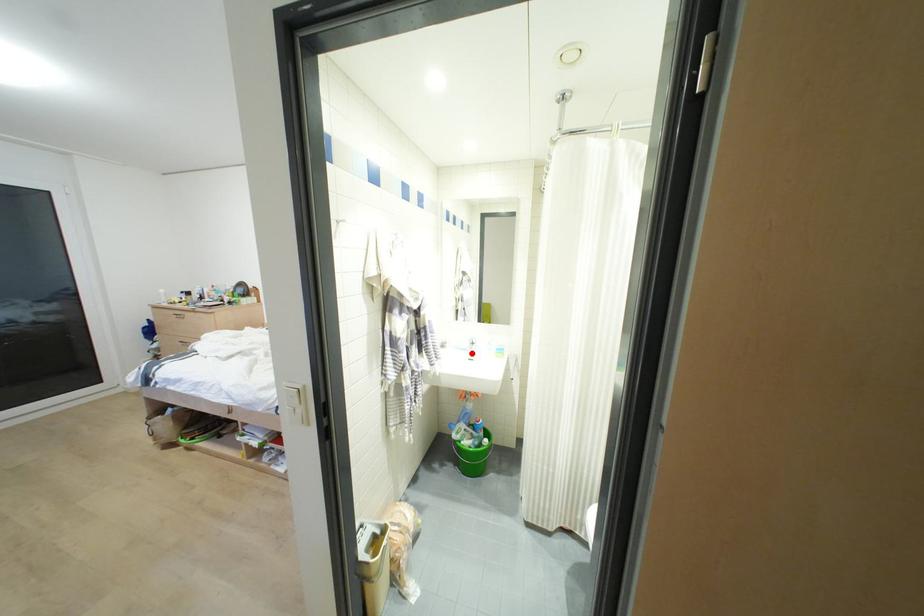
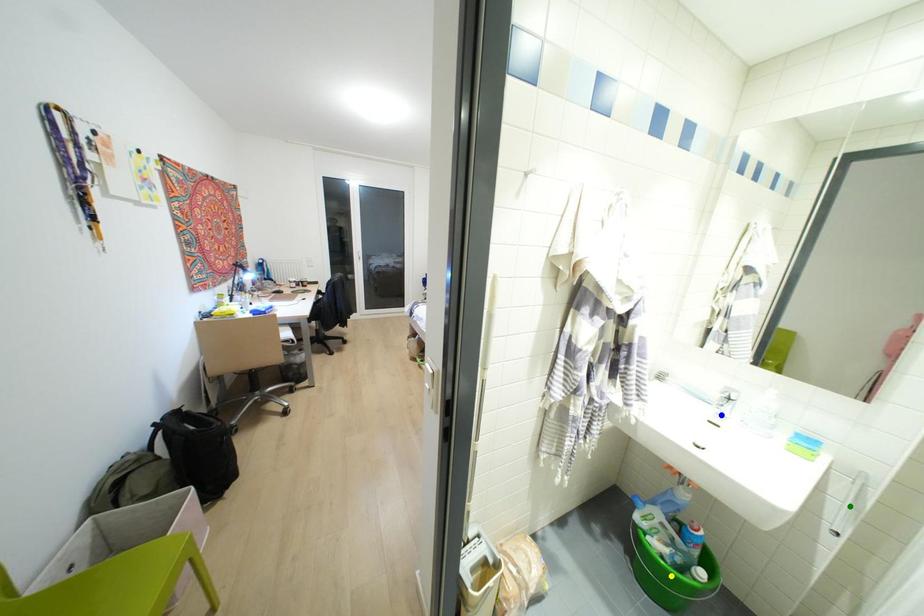
Question: I am providing you with two images of the same scene from different viewpoints. A red point is marked on the first image. You are given multiple points on the second image. Which point in image 2 represents the same 3d spot as the red point in image 1?

Choices:
 (A) green point
 (B) yellow point
 (C) blue point

Answer: (C)